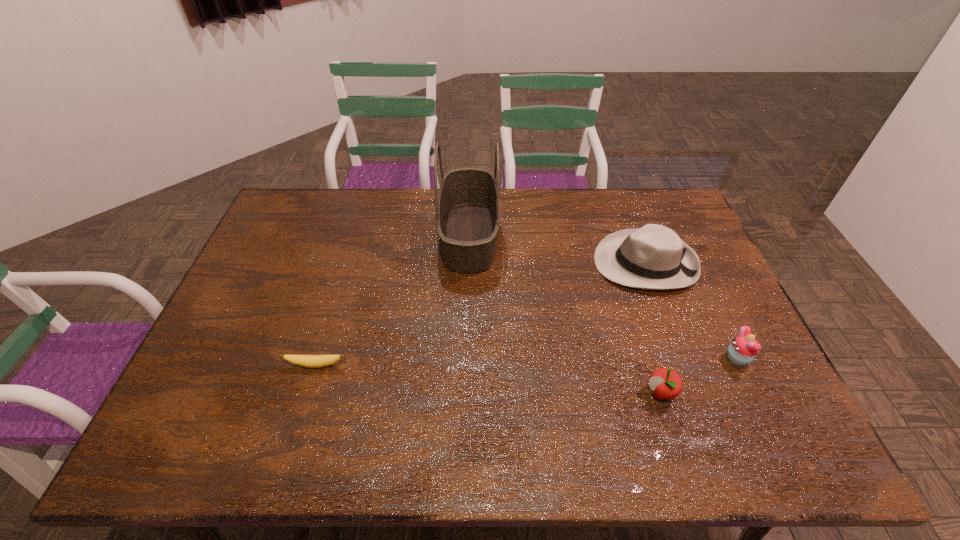
The image size is (960, 540). I want to click on free space located on the front-facing side of the fedora, so click(x=481, y=263).

The height and width of the screenshot is (540, 960). I want to click on vacant area situated 0.140m on the face of the cupcake, so click(671, 358).

You are a GUI agent. You are given a task and a screenshot of the screen. Output one action in this format:
    pyautogui.click(x=<x>, y=<y>)
    Task: Click on the free location located on the face of the cupcake
    
    Given the screenshot: What is the action you would take?
    pyautogui.click(x=652, y=358)

At what (x,y) coordinates should I click in order to perform the action: click on free region located 0.370m on the face of the cupcake. Please return your answer as a coordinate pair (x, y). The width and height of the screenshot is (960, 540). Looking at the image, I should click on (583, 358).

At what (x,y) coordinates should I click in order to perform the action: click on vacant space located 0.080m on the back of the apple. Please return your answer as a coordinate pair (x, y). Looking at the image, I should click on (648, 353).

Find the location of a particular element. This screenshot has height=540, width=960. blank area located 0.390m on the right of the banana is located at coordinates (499, 365).

I want to click on object that is at the far edge, so click(467, 206).

Locate an element on the screen. fedora at the right edge is located at coordinates (653, 257).

Where is `cupcake that is at the right edge`? The image size is (960, 540). cupcake that is at the right edge is located at coordinates (742, 350).

In the image, there is a desktop. Where is `vacant space at the far edge`? vacant space at the far edge is located at coordinates [597, 214].